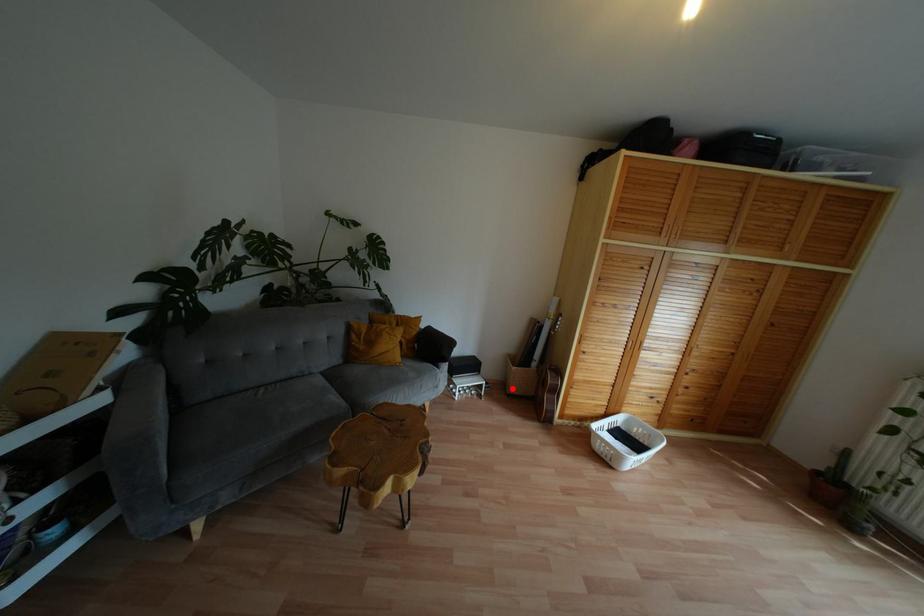
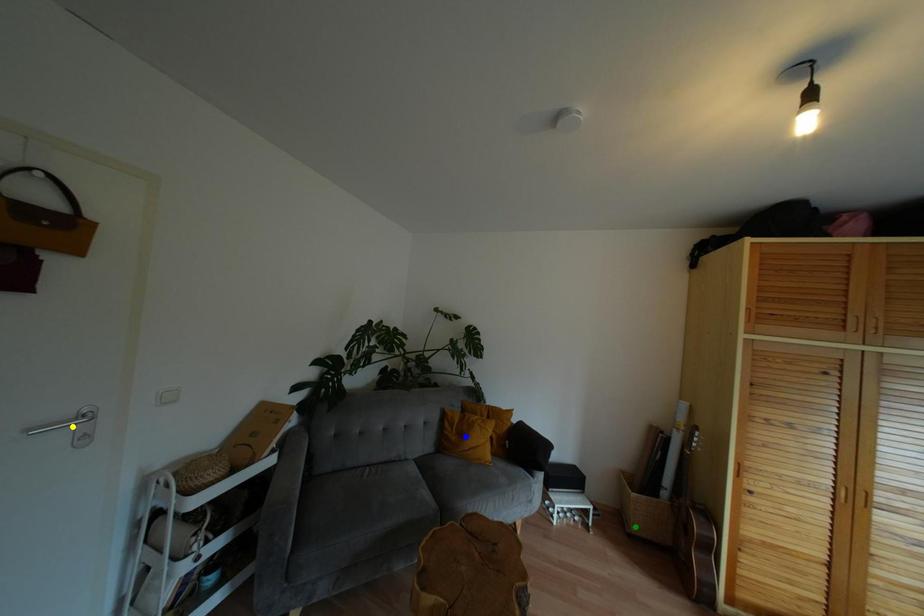
Question: I am providing you with two images of the same scene from different viewpoints. A red point is marked on the first image. You are given multiple points on the second image. Which point in image 2 is actually the same real-world point as the red point in image 1?

Choices:
 (A) green point
 (B) blue point
 (C) yellow point

Answer: (A)